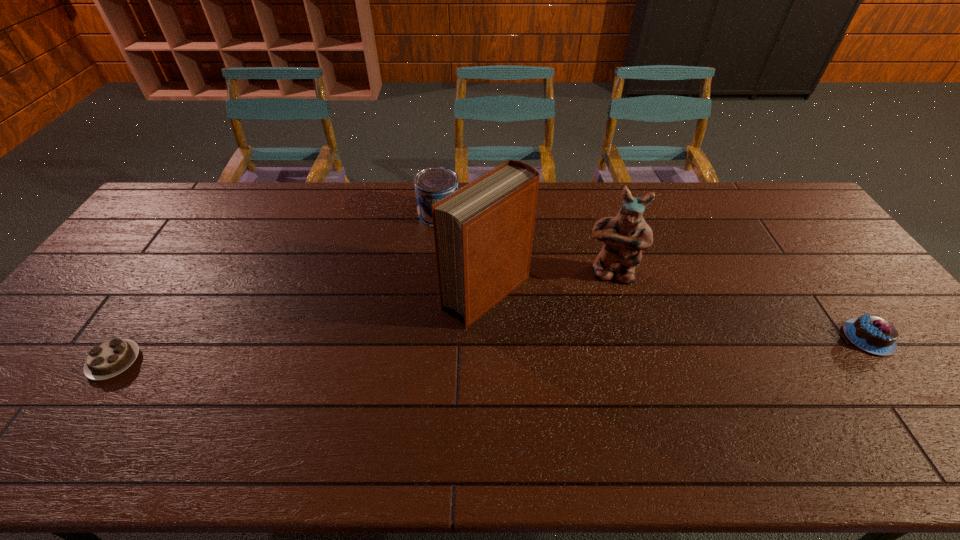
The height and width of the screenshot is (540, 960). What are the coordinates of `free space that satisfies the following two spatial constraints: 1. on the back side of the leftmost object; 2. on the right side of the second tallest object` in the screenshot? It's located at (173, 274).